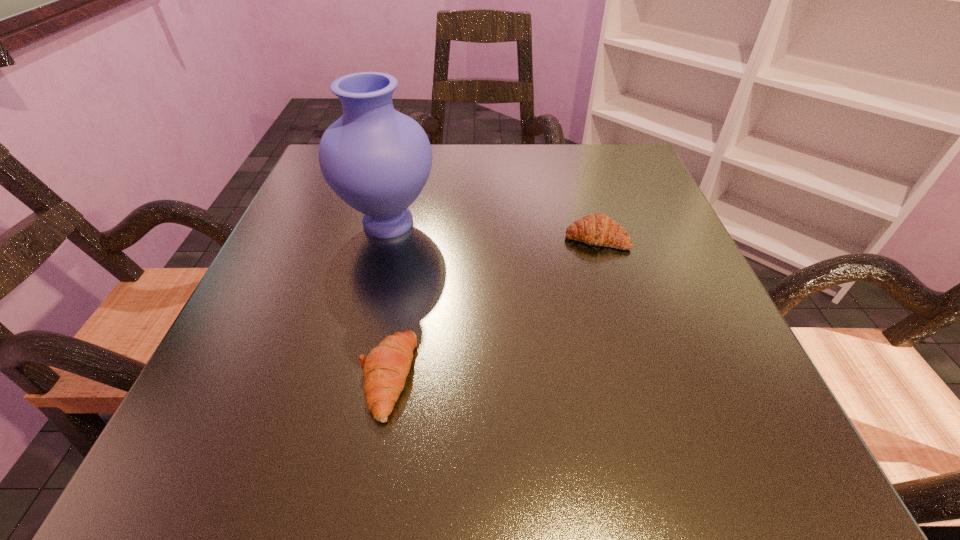
Identify the location of object that stands as the closest to the nearer crescent roll. [377, 160].

You are a GUI agent. You are given a task and a screenshot of the screen. Output one action in this format:
    pyautogui.click(x=<x>, y=<y>)
    Task: Click on the closest object to the tallest object
    Image resolution: width=960 pixels, height=540 pixels.
    Given the screenshot: What is the action you would take?
    pyautogui.click(x=385, y=369)

You are a GUI agent. You are given a task and a screenshot of the screen. Output one action in this format:
    pyautogui.click(x=<x>, y=<y>)
    Task: Click on the free space in the image that satisfies the following two spatial constraints: 1. on the front side of the vase; 2. on the left side of the left crescent roll
    The height and width of the screenshot is (540, 960).
    Given the screenshot: What is the action you would take?
    pyautogui.click(x=350, y=376)

What are the coordinates of `blank area in the image that satisfies the following two spatial constraints: 1. on the back side of the right crescent roll; 2. on the right side of the nearer crescent roll` in the screenshot? It's located at (411, 238).

Find the location of a particular element. free location that satisfies the following two spatial constraints: 1. on the front side of the tallest object; 2. on the left side of the nearest object is located at coordinates (350, 376).